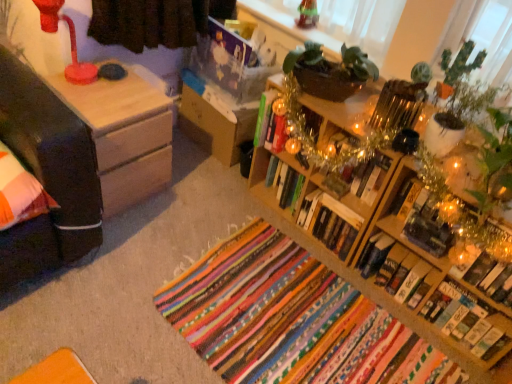
Locate an element on the screen. This screenshot has width=512, height=384. vacant area located to the right-hand side of matte plastic lamp at upper left is located at coordinates (110, 91).